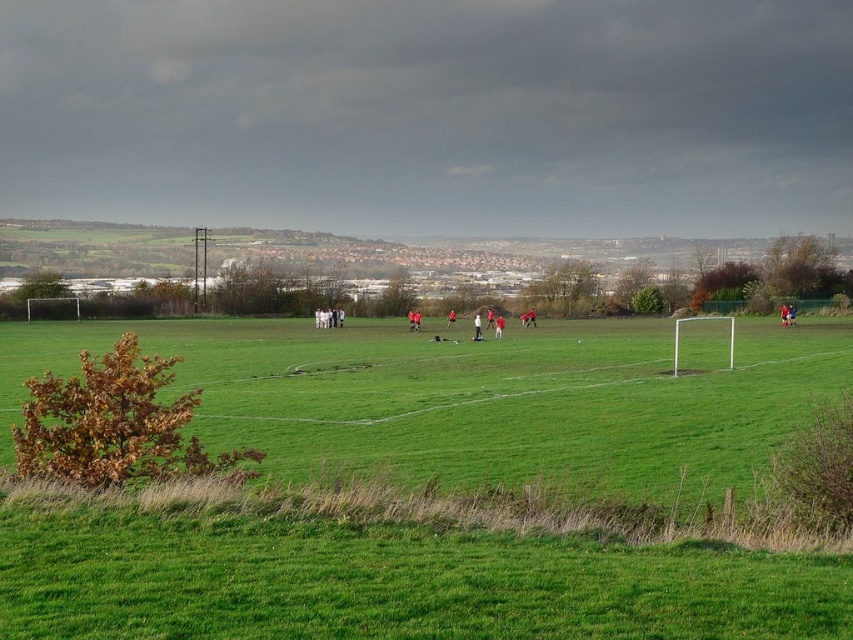
You are a photographer positioned at the edge of the soccer field. You notice two people at the center of the field. One is wearing a red jersey soccer player at center, and the other is a red fabric person at center. Which of these two is positioned more to the right side of the field?

The red jersey soccer player at center is positioned more to the right side of the field compared to the red fabric person at center.

You are a soccer coach observing the field. You notice the green grass field at center and the matte red soccer ball at center. Which object is taller?

The green grass field at center is much taller than the matte red soccer ball at center.

You are a soccer coach observing the field. You see the matte red soccer ball at center and the red jersey soccer player at center. Which object is positioned more to the left?

The matte red soccer ball at center is positioned more to the left than the red jersey soccer player at center.